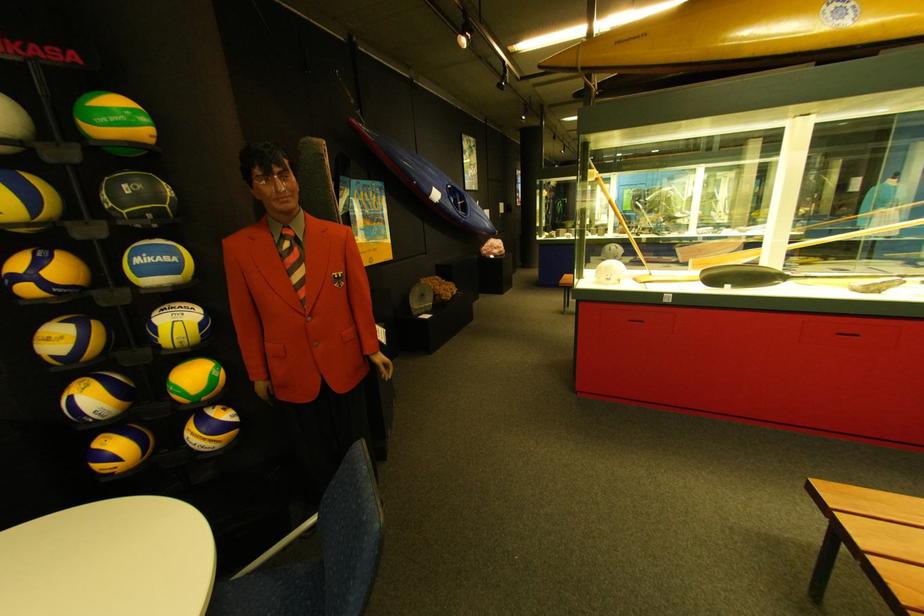
Where would you throw the black volleyball? Please return your answer as a coordinate pair (x, y).

(138, 198)